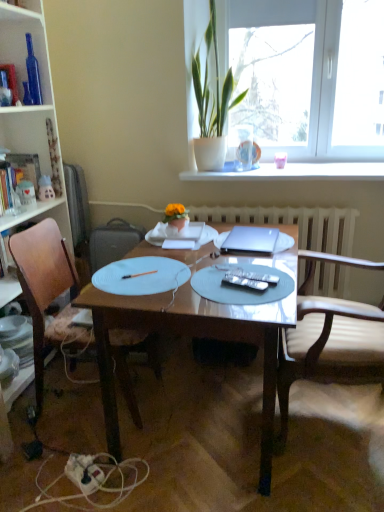
Where is `vacant region to the right of silver metallic remote control at center`? vacant region to the right of silver metallic remote control at center is located at coordinates (280, 285).